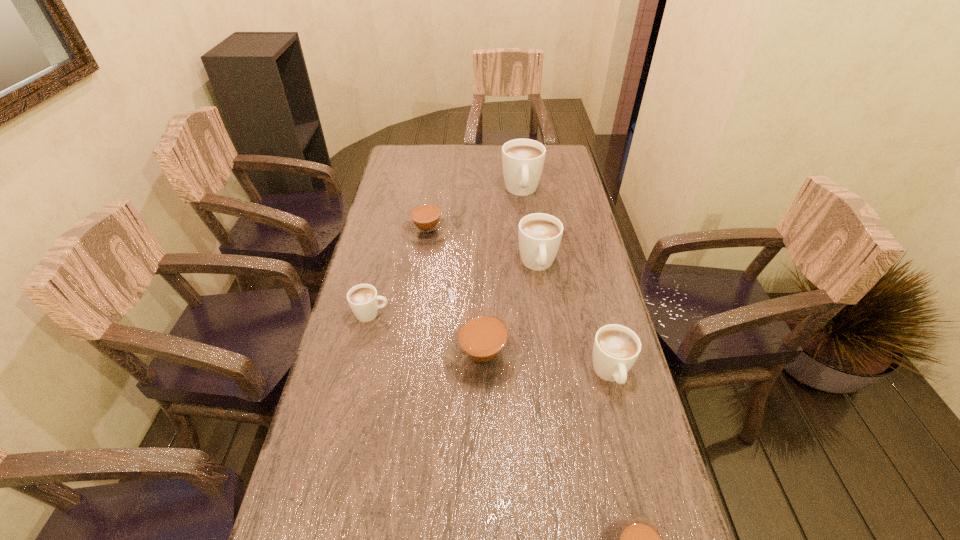
Locate an element on the screen. cappuccino identified as the second closest to the third farthest cappuccino is located at coordinates (426, 224).

Select which white cappuccino is the second closest to the second farthest white cappuccino. Please provide its 2D coordinates. Your answer should be formatted as a tuple, i.e. [(x, y)], where the tuple contains the x and y coordinates of a point satisfying the conditions above.

[(616, 348)]

This screenshot has width=960, height=540. I want to click on white cappuccino that is the second closest one to the second farthest brown cappuccino, so click(539, 234).

Select which brown cappuccino appears as the closest to the biggest brown cappuccino. Please provide its 2D coordinates. Your answer should be formatted as a tuple, i.e. [(x, y)], where the tuple contains the x and y coordinates of a point satisfying the conditions above.

[(627, 539)]

Locate an element on the screen. brown cappuccino that stands as the closest to the smallest brown cappuccino is located at coordinates (482, 351).

Locate an element on the screen. The width and height of the screenshot is (960, 540). free point that satisfies the following two spatial constraints: 1. with the handle on the side of the second farthest white cappuccino; 2. with the handle on the side of the third farthest white cappuccino is located at coordinates (544, 314).